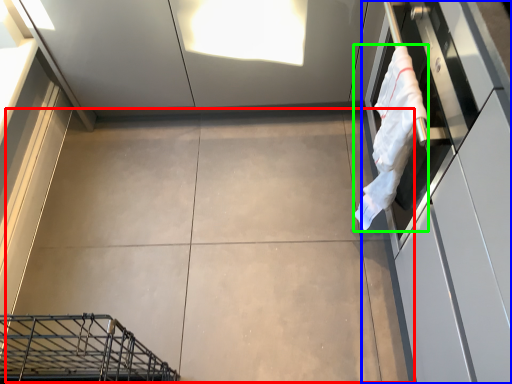
Question: Estimate the real-world distances between objects in this image. Which object is closer to concrete (highlighted by a red box), cabinetry (highlighted by a blue box) or laundry (highlighted by a green box)?

Choices:
 (A) cabinetry
 (B) laundry

Answer: (B)